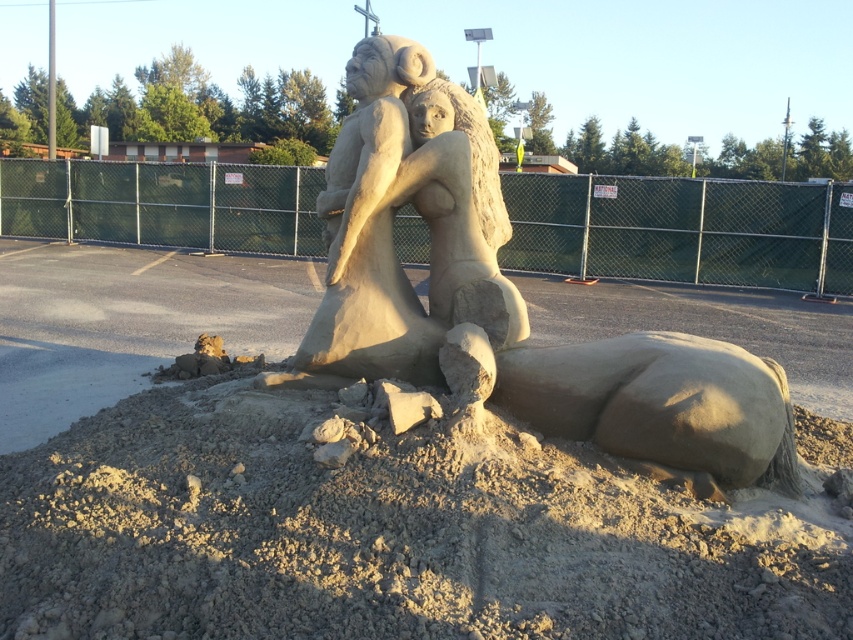
You are standing in front of the sand sculpture and want to place a small flag exactly where the dry sand at center is located. According to the coordinates provided, where should you place the flag?

You should place the flag at the coordinates point (379,536) where the dry sand at center is located.